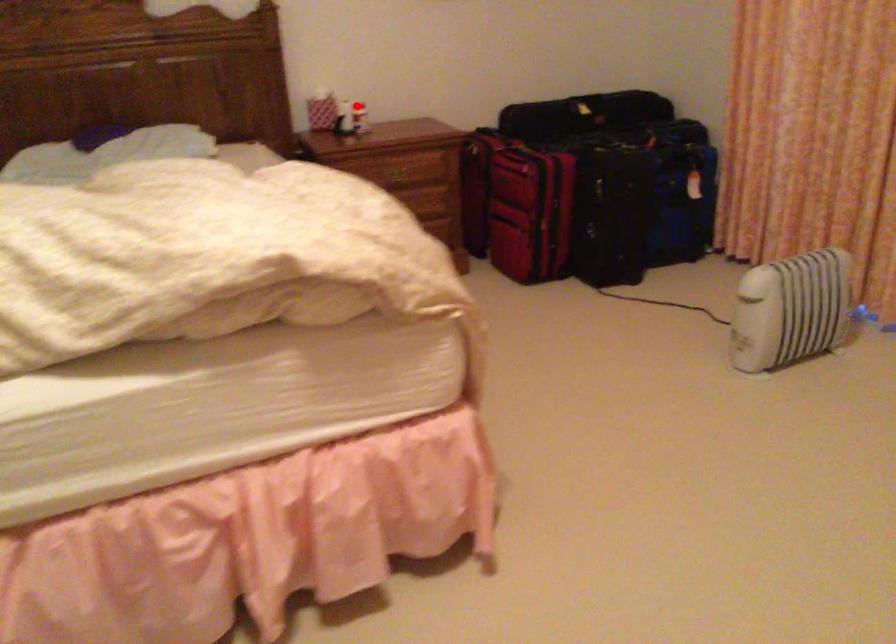
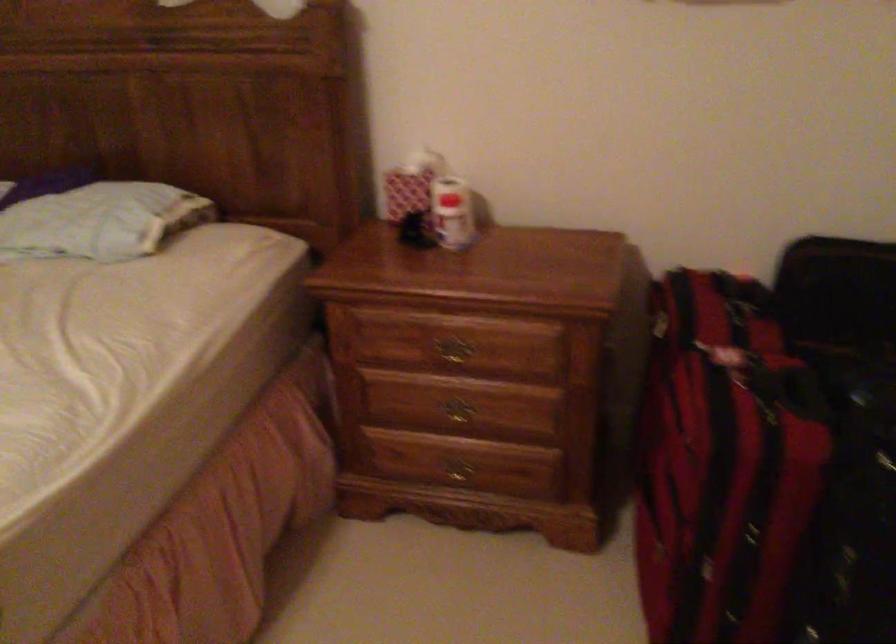
Question: I am providing you with two images of the same scene from different viewpoints. In image1, a red point is highlighted. Considering the same 3D point in image2, which of the following is correct?

Choices:
 (A) It is closer
 (B) It is farther

Answer: (A)